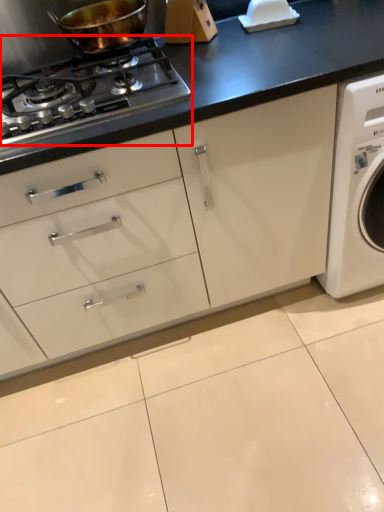
Question: Considering the relative positions of gas stove (annotated by the red box) and kitchen appliance in the image provided, where is gas stove (annotated by the red box) located with respect to the staircase?

Choices:
 (A) right
 (B) left

Answer: (B)